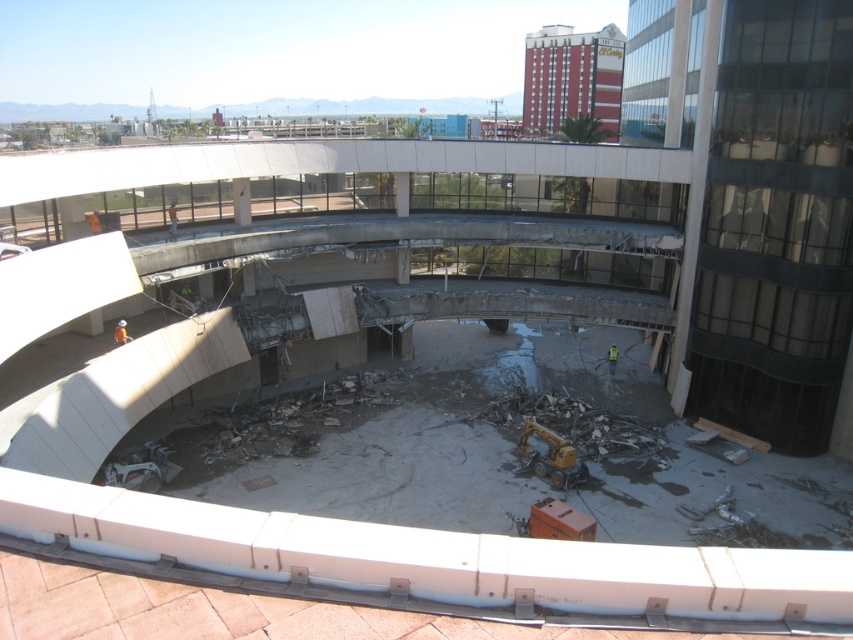
Question: Is orange safety vest at lower center positioned in front of green reflective safety vest at lower center?

Choices:
 (A) yes
 (B) no

Answer: (A)

Question: Can you confirm if orange safety vest at lower center is smaller than green reflective safety vest at lower center?

Choices:
 (A) yes
 (B) no

Answer: (A)

Question: Which of the following is the farthest from the observer?

Choices:
 (A) green reflective safety vest at lower center
 (B) orange safety vest at lower center

Answer: (A)

Question: Does orange safety vest at lower center appear on the left side of green reflective safety vest at lower center?

Choices:
 (A) no
 (B) yes

Answer: (B)

Question: Which of the following is the closest to the observer?

Choices:
 (A) orange safety vest at lower center
 (B) green reflective safety vest at lower center

Answer: (A)